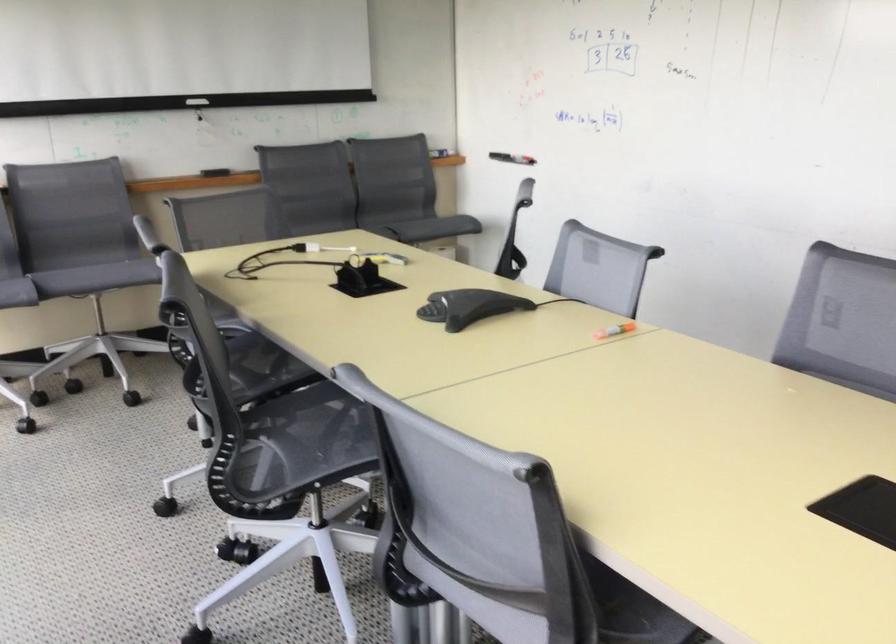
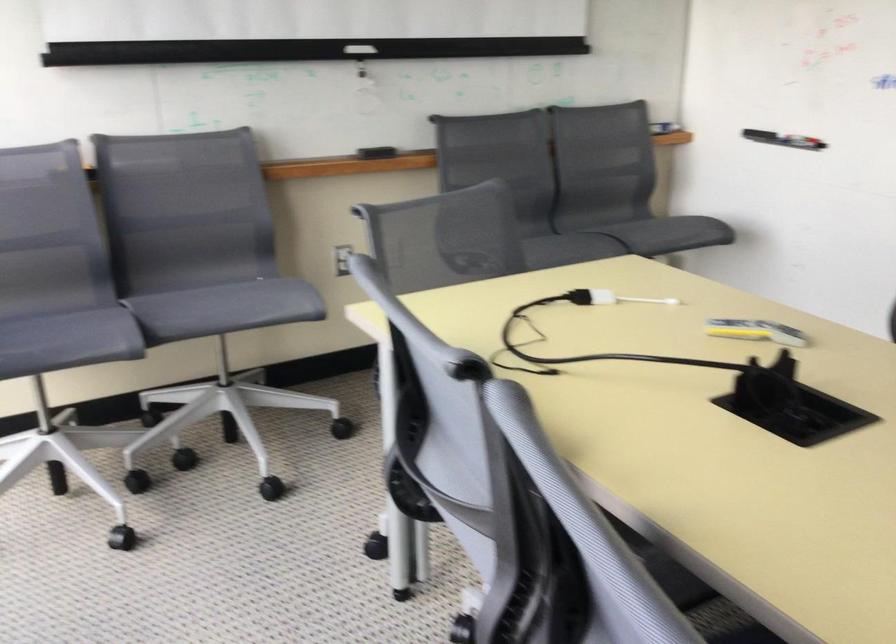
The point at (388,261) is marked in the first image. Where is the corresponding point in the second image?

(755, 330)